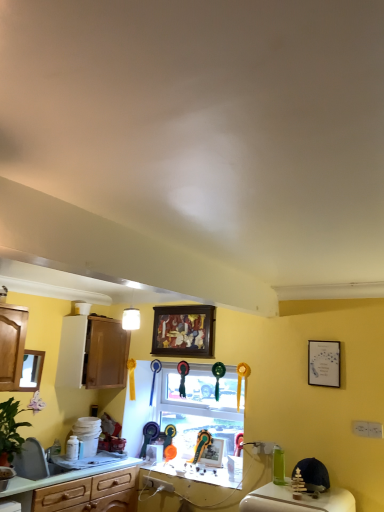
In order to face matte wood cabinet at left, should I rotate leftwards or rightwards?

To face it directly, rotate left by 12.217 degrees.

The height and width of the screenshot is (512, 384). Describe the element at coordinates (199, 407) in the screenshot. I see `clear glass window at center` at that location.

What are the coordinates of `wooden framed artwork at upper center, which appears as the fourth picture frame when ordered from the bottom` in the screenshot? It's located at (184, 331).

The height and width of the screenshot is (512, 384). Find the location of `white glossy countertop at center`. white glossy countertop at center is located at coordinates (201, 472).

The height and width of the screenshot is (512, 384). I want to click on matte wood cabinet at left, so click(x=92, y=353).

Is metallic silver picture frame at center, positioned as the 2th picture frame in right-to-left order, at the left side of clear glass window at center?

In fact, metallic silver picture frame at center, positioned as the 2th picture frame in right-to-left order, is to the right of clear glass window at center.

In terms of height, does metallic silver picture frame at center, which appears as the third picture frame when viewed from the left, look taller or shorter compared to clear glass window at center?

metallic silver picture frame at center, which appears as the third picture frame when viewed from the left, is shorter than clear glass window at center.

From a real-world perspective, does metallic silver picture frame at center, which appears as the third picture frame when viewed from the left, sit lower than clear glass window at center?

Yes.

Which point is more forward, (217, 454) or (207, 416)?

Point (217, 454)

Considering the sizes of matte wood cabinet at left and green laminate countertop at lower left in the image, is matte wood cabinet at left wider or thinner than green laminate countertop at lower left?

In the image, matte wood cabinet at left appears to be more narrow than green laminate countertop at lower left.

From the image's perspective, is matte wood cabinet at left positioned above or below green laminate countertop at lower left?

matte wood cabinet at left is situated higher than green laminate countertop at lower left in the image.

Is matte wood cabinet at left in contact with green laminate countertop at lower left?

No, matte wood cabinet at left is not with green laminate countertop at lower left.

Considering the relative sizes of matte wood cabinet at left and green laminate countertop at lower left in the image provided, is matte wood cabinet at left shorter than green laminate countertop at lower left?

In fact, matte wood cabinet at left may be taller than green laminate countertop at lower left.

From the image's perspective, relative to clear glass window at center, is wooden mirror at left, the second picture frame positioned from the bottom, above or below?

From the image's perspective, wooden mirror at left, the second picture frame positioned from the bottom, appears above clear glass window at center.

How many degrees apart are the facing directions of wooden mirror at left, placed as the first picture frame when sorted from left to right, and clear glass window at center?

89.2 degrees.

Between wooden mirror at left, placed as the 4th picture frame when sorted from right to left, and clear glass window at center, which one has smaller width?

Thinner between the two is wooden mirror at left, placed as the 4th picture frame when sorted from right to left.

From a real-world perspective, which is physically below, metallic silver picture frame at center, the 1th picture frame when ordered from bottom to top, or white glossy countertop at center?

From a 3D spatial view, white glossy countertop at center is below.

Which object is positioned more to the right, metallic silver picture frame at center, the 1th picture frame positioned from the back, or white glossy countertop at center?

metallic silver picture frame at center, the 1th picture frame positioned from the back, is more to the right.

Which object is further away from the camera, metallic silver picture frame at center, the 4th picture frame in the front-to-back sequence, or white glossy countertop at center?

metallic silver picture frame at center, the 4th picture frame in the front-to-back sequence, is further from the camera.

Is metallic silver picture frame at center, the 4th picture frame when ordered from top to bottom, positioned with its back to white glossy countertop at center?

No.

Is clear glass window at center in contact with white matte picture frame at upper right, the 3th picture frame ordered from the bottom?

There is a gap between clear glass window at center and white matte picture frame at upper right, the 3th picture frame ordered from the bottom.

Consider the image. Is clear glass window at center turned away from white matte picture frame at upper right, the first picture frame from the front?

clear glass window at center does not have its back to white matte picture frame at upper right, the first picture frame from the front.

Does point (190, 429) appear closer or farther from the camera than point (332, 345)?

Point (190, 429) appears to be farther away from the viewer than point (332, 345).

Can you confirm if clear glass window at center is taller than white matte picture frame at upper right, which is counted as the 2th picture frame, starting from the top?

Correct, clear glass window at center is much taller as white matte picture frame at upper right, which is counted as the 2th picture frame, starting from the top.

From the image's perspective, is white glossy sink at lower left above green laminate countertop at lower left?

Correct, white glossy sink at lower left appears higher than green laminate countertop at lower left in the image.

Considering the positions of objects white glossy sink at lower left and green laminate countertop at lower left in the image provided, who is in front, white glossy sink at lower left or green laminate countertop at lower left?

green laminate countertop at lower left.

Can you confirm if white glossy sink at lower left is taller than green laminate countertop at lower left?

Indeed, white glossy sink at lower left has a greater height compared to green laminate countertop at lower left.

Considering the relative positions of white glossy sink at lower left and green laminate countertop at lower left in the image provided, is white glossy sink at lower left to the right of green laminate countertop at lower left from the viewer's perspective?

No.

Is point (232, 366) farther from camera compared to point (36, 369)?

Yes, point (232, 366) is farther from viewer.

Is wooden mirror at left, the second picture frame positioned from the bottom, inside clear glass window at center?

No, wooden mirror at left, the second picture frame positioned from the bottom, is located outside of clear glass window at center.

Is clear glass window at center in contact with wooden mirror at left, which appears as the 3th picture frame when viewed from the top?

No, clear glass window at center is not with wooden mirror at left, which appears as the 3th picture frame when viewed from the top.

From a real-world perspective, which is physically below, clear glass window at center or wooden mirror at left, the second picture frame positioned from the bottom?

clear glass window at center, from a real-world perspective.

The width and height of the screenshot is (384, 512). I want to click on window that appears above the metallic silver picture frame at center, the 1th picture frame when ordered from bottom to top (from a real-world perspective), so click(x=199, y=407).

Identify the location of countertop that appears on the left of matte wood cabinet at left. (71, 473).

When comparing their distances from white glossy countertop at center, does wooden mirror at left, which is the 3th picture frame from back to front, or matte wood cabinet at left seem further?

Based on the image, wooden mirror at left, which is the 3th picture frame from back to front, appears to be further to white glossy countertop at center.

Estimate the real-world distances between objects in this image. Which object is closer to matte wood cabinet at left, wooden mirror at left, which appears as the 3th picture frame when viewed from the top, or green laminate countertop at lower left?

Based on the image, wooden mirror at left, which appears as the 3th picture frame when viewed from the top, appears to be nearer to matte wood cabinet at left.

Estimate the real-world distances between objects in this image. Which object is further from clear glass window at center, white matte picture frame at upper right, the first picture frame from the front, or green laminate countertop at lower left?

white matte picture frame at upper right, the first picture frame from the front, is further to clear glass window at center.

Based on their spatial positions, is wooden mirror at left, the second picture frame positioned from the bottom, or matte wood cabinet at left closer to white glossy sink at lower left?

wooden mirror at left, the second picture frame positioned from the bottom.

When comparing their distances from wooden framed artwork at upper center, positioned as the second picture frame in left-to-right order, does green laminate countertop at lower left or matte wood cabinet at left seem closer?

matte wood cabinet at left is closer to wooden framed artwork at upper center, positioned as the second picture frame in left-to-right order.

Which object lies nearer to the anchor point metallic silver picture frame at center, the 1th picture frame positioned from the back, white glossy sink at lower left or clear glass window at center?

clear glass window at center lies closer to metallic silver picture frame at center, the 1th picture frame positioned from the back, than the other object.

Which object lies nearer to the anchor point wooden framed artwork at upper center, positioned as the second picture frame in left-to-right order, matte wood cabinet at left or white glossy sink at lower left?

matte wood cabinet at left lies closer to wooden framed artwork at upper center, positioned as the second picture frame in left-to-right order, than the other object.

When comparing their distances from clear glass window at center, does white glossy sink at lower left or green laminate countertop at lower left seem closer?

green laminate countertop at lower left.

The height and width of the screenshot is (512, 384). What are the coordinates of `sink between wooden mirror at left, the second picture frame viewed from the front, and white matte picture frame at upper right, the fourth picture frame in the back-to-front sequence` in the screenshot? It's located at (35, 462).

At what (x,y) coordinates should I click in order to perform the action: click on countertop between white glossy sink at lower left and clear glass window at center from left to right. Please return your answer as a coordinate pair (x, y). The width and height of the screenshot is (384, 512). Looking at the image, I should click on (71, 473).

Find the location of `window between matte wood cabinet at left and metallic silver picture frame at center, the 4th picture frame when ordered from top to bottom, from left to right`. window between matte wood cabinet at left and metallic silver picture frame at center, the 4th picture frame when ordered from top to bottom, from left to right is located at coordinates (199, 407).

You are a GUI agent. You are given a task and a screenshot of the screen. Output one action in this format:
    pyautogui.click(x=<x>, y=<y>)
    Task: Click on the cabinetry between white glossy sink at lower left and metallic silver picture frame at center, positioned as the 2th picture frame in right-to-left order, in the horizontal direction
    
    Given the screenshot: What is the action you would take?
    pyautogui.click(x=92, y=353)